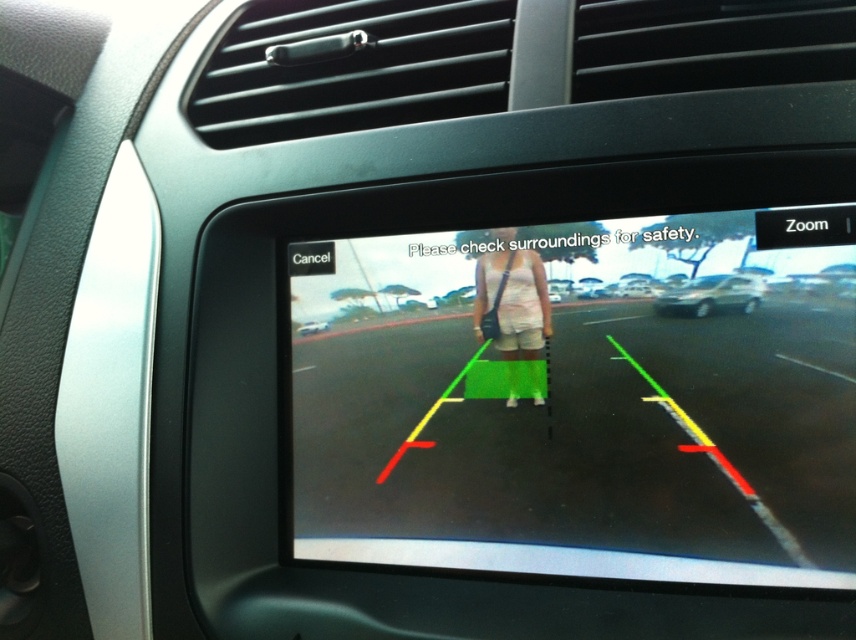
You are driving a car and see the matte black display at center and the white cotton shorts at center on the rearview camera screen. Which object is closer to the right edge of the screen?

The matte black display at center is to the right of the white cotton shorts at center, so the matte black display at center is closer to the right edge of the screen.